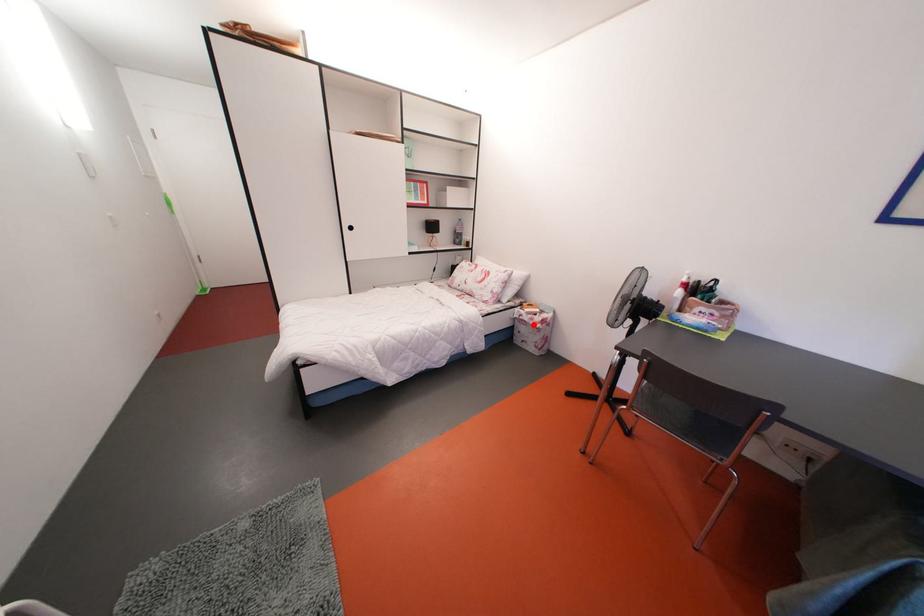
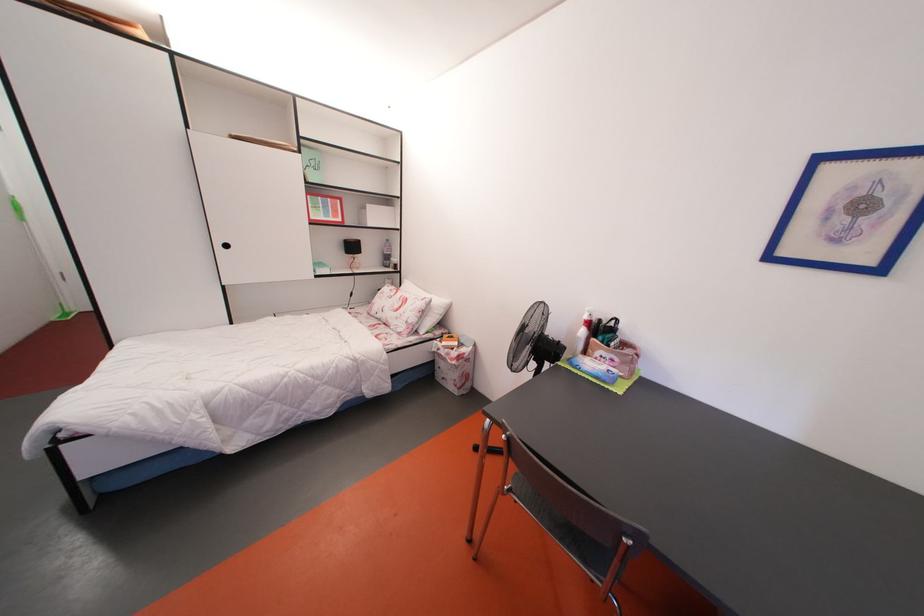
Question: I am providing you with two images of the same scene from different viewpoints. Image1 has a red point marked. In image2, the corresponding 3D location appears at what relative position? Reply with the corresponding letter.

Choices:
 (A) Closer
 (B) Farther

Answer: (B)